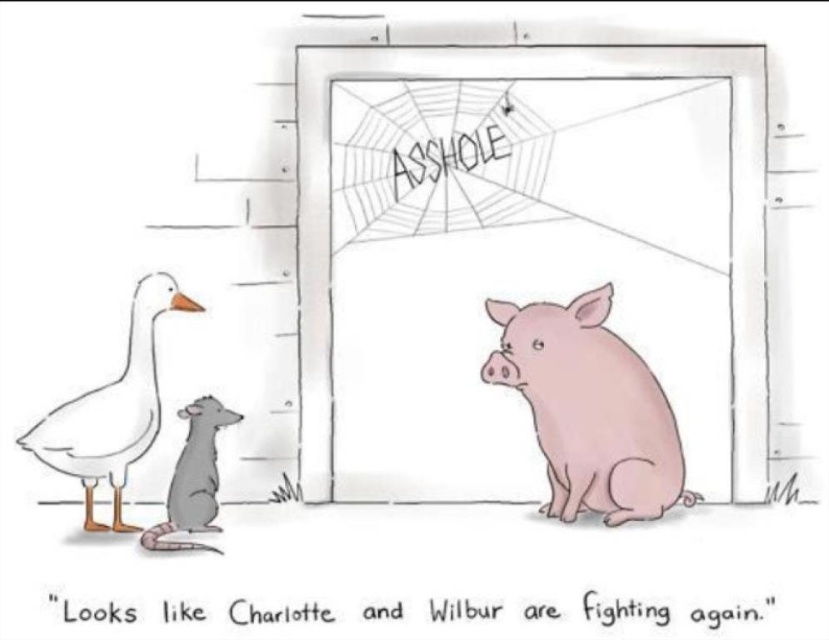
Who is positioned more to the left, pink matte pig at right or white matte duck at left?

Positioned to the left is white matte duck at left.

Between pink matte pig at right and white matte duck at left, which one has more height?

white matte duck at left

Find the location of a particular element. This screenshot has height=640, width=829. pink matte pig at right is located at coordinates (589, 410).

Between pink matte pig at right and gray matte rat at lower left, which one has less height?

gray matte rat at lower left is shorter.

Between pink matte pig at right and gray matte rat at lower left, which one appears on the right side from the viewer's perspective?

Positioned to the right is pink matte pig at right.

The width and height of the screenshot is (829, 640). Identify the location of pink matte pig at right. (589, 410).

In order to click on pink matte pig at right in this screenshot , I will do [589, 410].

Can you confirm if white matte duck at left is shorter than gray matte rat at lower left?

No, white matte duck at left is not shorter than gray matte rat at lower left.

Is point (128, 449) positioned before point (194, 518)?

Yes.

Find the location of a particular element. white matte duck at left is located at coordinates (112, 410).